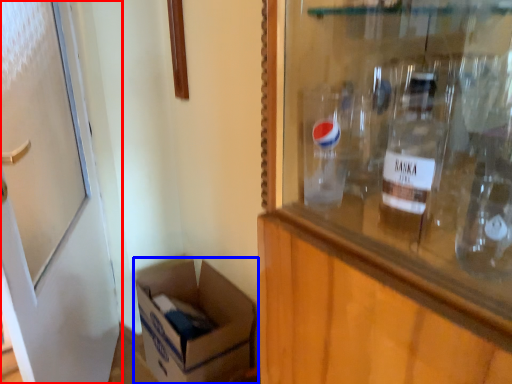
Question: Which of the following is the closest to the observer, door (highlighted by a red box) or box (highlighted by a blue box)?

Choices:
 (A) door
 (B) box

Answer: (A)